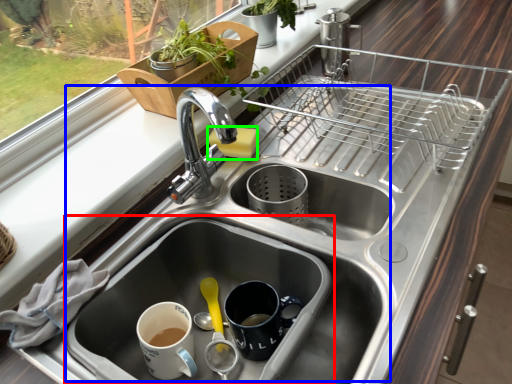
Question: Which object is positioned closest to sink (highlighted by a red box)? Select from sink (highlighted by a blue box) and soap (highlighted by a green box).

Choices:
 (A) sink
 (B) soap

Answer: (A)